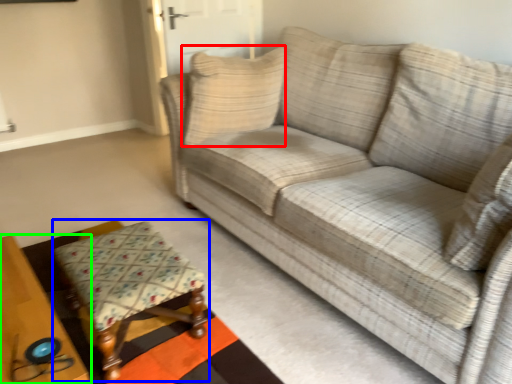
Question: Considering the real-world distances, which object is closest to pillow (highlighted by a red box)? stool (highlighted by a blue box) or table (highlighted by a green box).

Choices:
 (A) stool
 (B) table

Answer: (A)